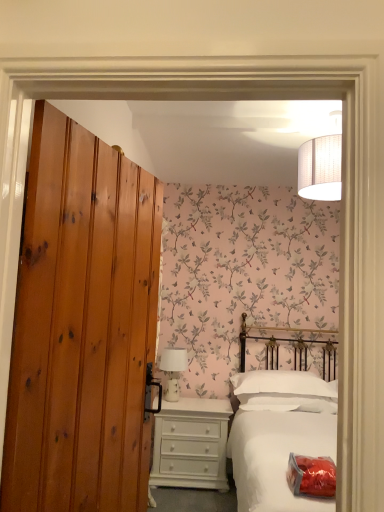
Question: Considering the positions of point (3, 466) and point (172, 394), is point (3, 466) closer or farther from the camera than point (172, 394)?

Choices:
 (A) farther
 (B) closer

Answer: (B)

Question: Is knotty pine door at left wider or thinner than white ceramic table lamp at center?

Choices:
 (A) wide
 (B) thin

Answer: (B)

Question: Which is farther from the white matte bed at center?

Choices:
 (A) white ceramic table lamp at center
 (B) knotty pine door at left
 (C) white painted wood chest of drawers at lower center
 (D) white soft pillow at center

Answer: (B)

Question: Considering the real-world distances, which object is farthest from the knotty pine door at left?

Choices:
 (A) white painted wood chest of drawers at lower center
 (B) white ceramic table lamp at center
 (C) white soft pillow at center
 (D) white matte bed at center

Answer: (B)